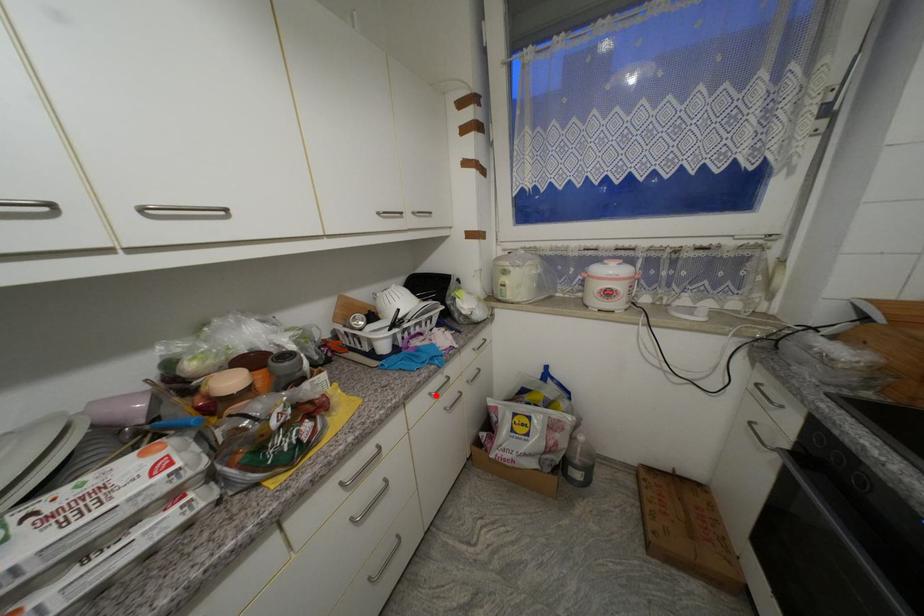
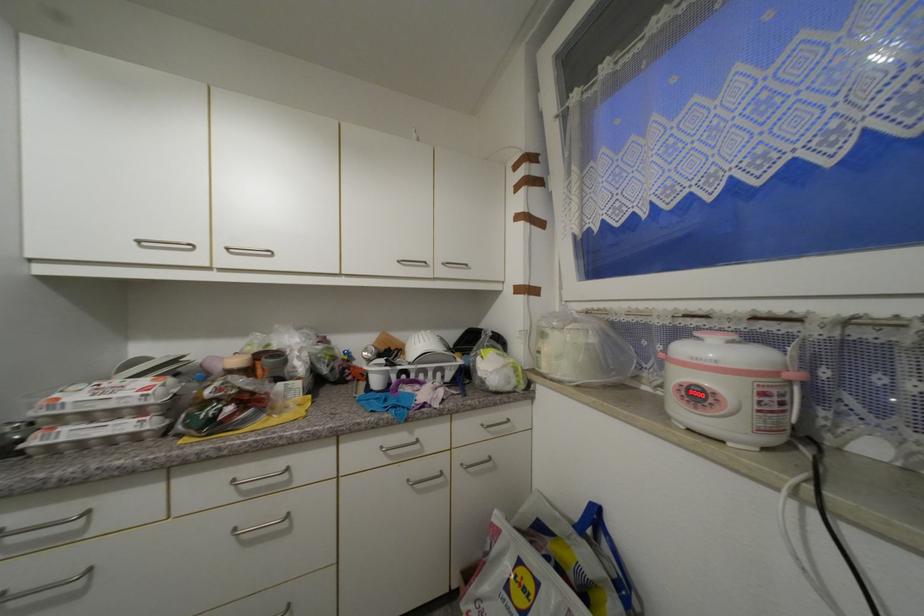
Find the pixel in the second image that matches the highlighted location in the first image.

(387, 448)